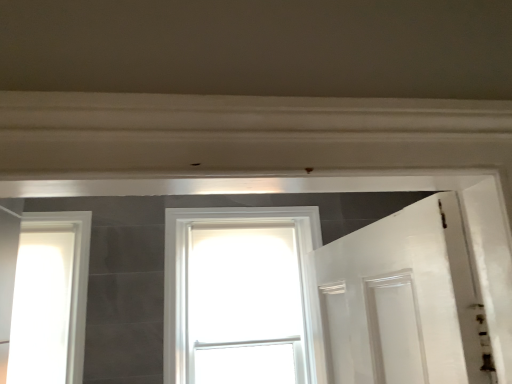
Question: Considering the positions of white glossy window at center, which appears as the 1th window when viewed from the right, and white glossy window at left, the first window in the left-to-right sequence, in the image, is white glossy window at center, which appears as the 1th window when viewed from the right, taller or shorter than white glossy window at left, the first window in the left-to-right sequence,?

Choices:
 (A) short
 (B) tall

Answer: (B)

Question: From a real-world perspective, relative to white glossy window at left, the first window in the left-to-right sequence, is white glossy window at center, which appears as the 1th window when viewed from the right, vertically above or below?

Choices:
 (A) below
 (B) above

Answer: (A)

Question: In the image, is white glossy window at center, which appears as the 1th window when viewed from the right, positioned in front of or behind white glossy window at left, the first window in the left-to-right sequence?

Choices:
 (A) front
 (B) behind

Answer: (B)

Question: In terms of width, does white glossy window at left, the first window in the left-to-right sequence, look wider or thinner when compared to white glossy window at center, which appears as the 1th window when viewed from the right?

Choices:
 (A) wide
 (B) thin

Answer: (B)

Question: Is white glossy window at left, which ranks as the 2th window in right-to-left order, bigger or smaller than white glossy window at center, which appears as the 1th window when viewed from the right?

Choices:
 (A) small
 (B) big

Answer: (A)

Question: Is white glossy window at left, the first window in the left-to-right sequence, in front of or behind white glossy window at center, which appears as the 2th window when viewed from the left, in the image?

Choices:
 (A) front
 (B) behind

Answer: (A)

Question: Based on their positions, is white glossy window at left, the first window in the left-to-right sequence, located to the left or right of white glossy window at center, which appears as the 2th window when viewed from the left?

Choices:
 (A) left
 (B) right

Answer: (A)